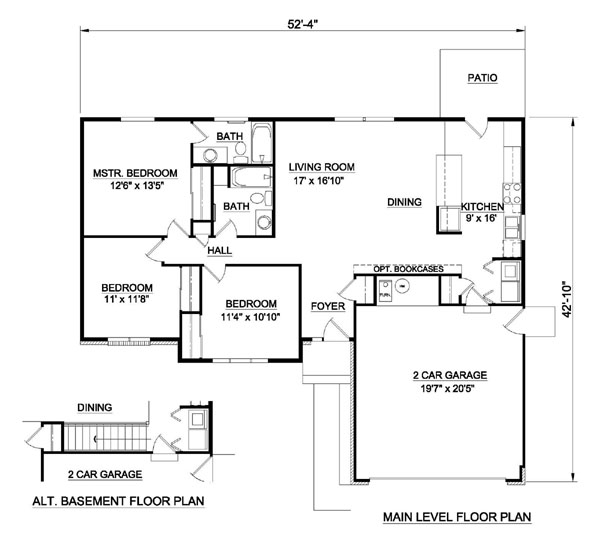
Where is `master bedroom`? The width and height of the screenshot is (600, 544). master bedroom is located at coordinates (148, 204).